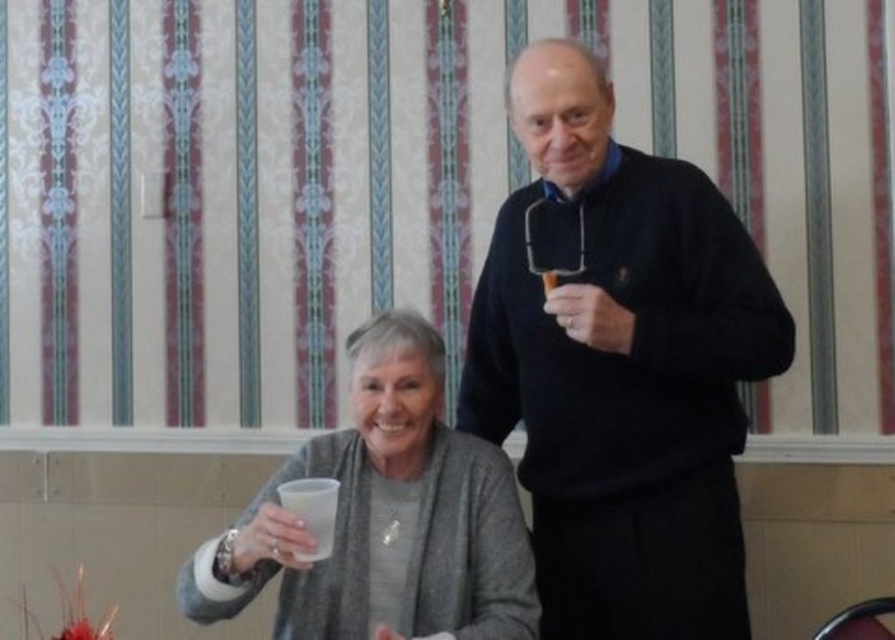
You are standing in the room and want to place a new decorative item exactly where the black matte sweater at center is currently located. What are the coordinates where you should place it?

The coordinates for placing the new decorative item should be at point (620, 365), which is where the black matte sweater at center is located.

You are a photographer setting up a shot of the two people in the scene. You want to ensure that both the black matte sweater at center and the translucent plastic cup at center are clearly visible in the frame. Since the sweater is larger than the cup, which object should you focus on first to ensure proper depth of field?

The black matte sweater at center has a greater height compared to the translucent plastic cup at center, so you should focus on the black matte sweater at center first to ensure both are in focus.